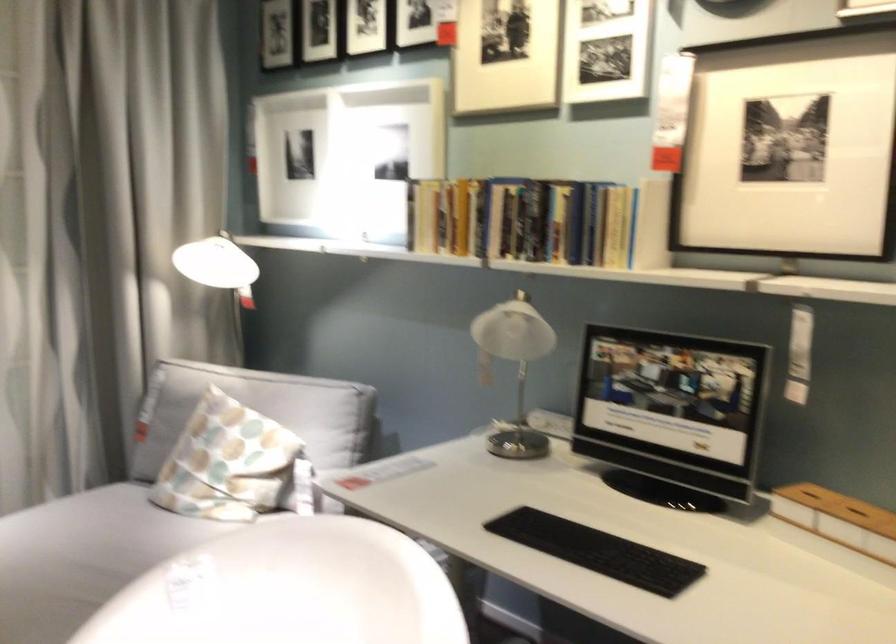
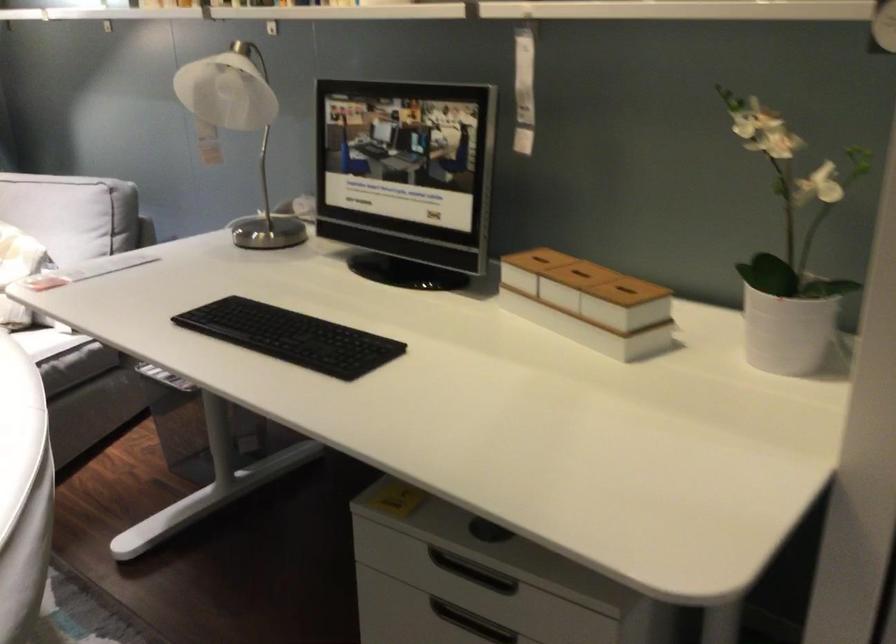
Locate, in the second image, the point that corresponds to (x=512, y=357) in the first image.

(239, 128)